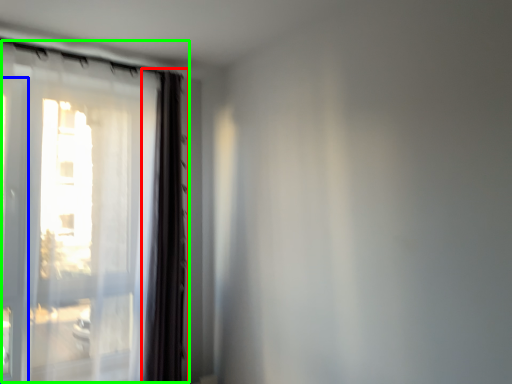
Question: Which object is positioned closest to curtain (highlighted by a red box)? Select from screen door (highlighted by a blue box) and window (highlighted by a green box).

Choices:
 (A) screen door
 (B) window

Answer: (B)